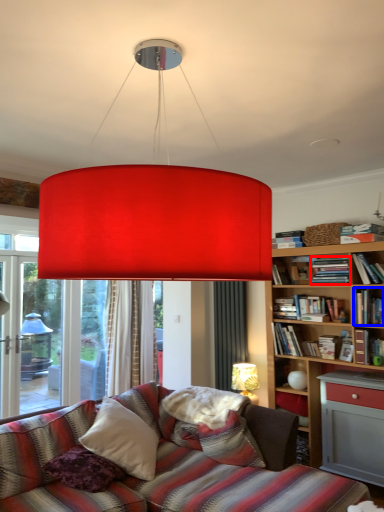
Question: Among these objects, which one is farthest to the camera, book (highlighted by a red box) or book (highlighted by a blue box)?

Choices:
 (A) book
 (B) book

Answer: (A)